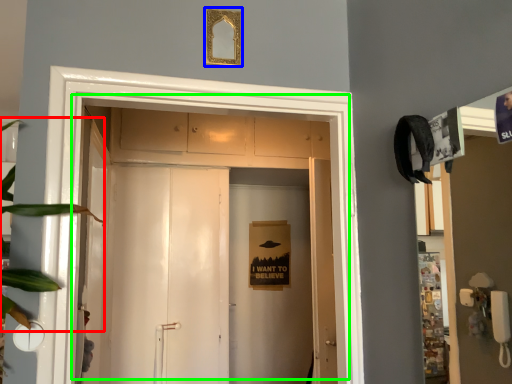
Question: Which is farther away from plant (highlighted by a red box)? picture frame (highlighted by a blue box) or door (highlighted by a green box)?

Choices:
 (A) picture frame
 (B) door

Answer: (B)